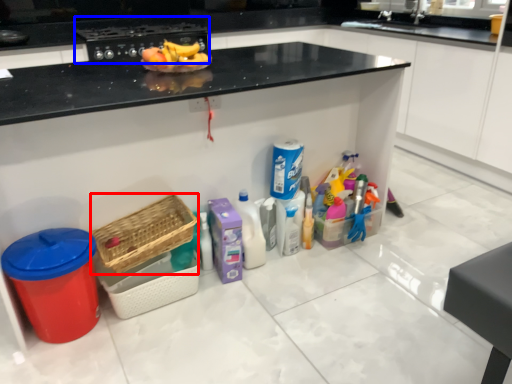
Question: Which point is further to the camera, basket (highlighted by a red box) or appliance (highlighted by a blue box)?

Choices:
 (A) basket
 (B) appliance

Answer: (B)